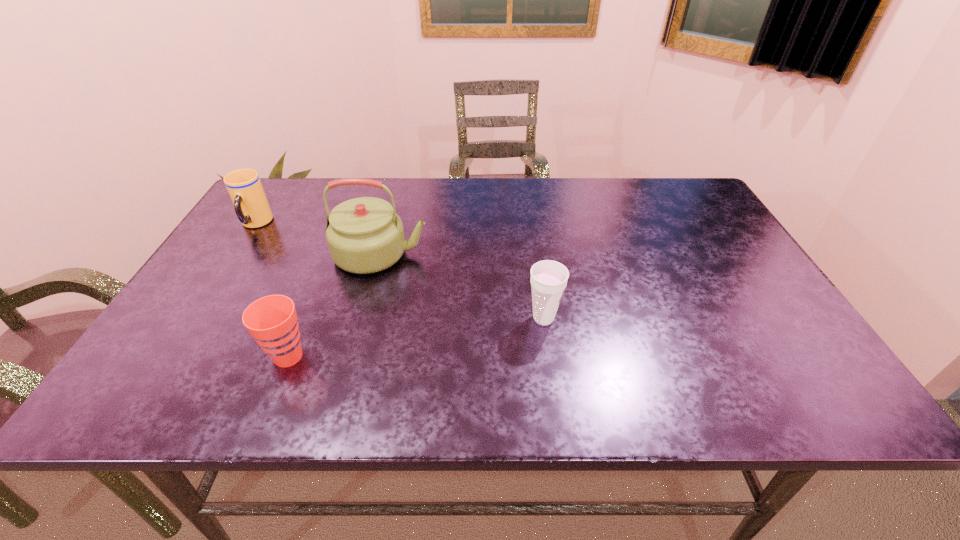
Identify which object is located as the third nearest to the nearest cup. Please provide its 2D coordinates. Your answer should be formatted as a tuple, i.e. [(x, y)], where the tuple contains the x and y coordinates of a point satisfying the conditions above.

[(548, 280)]

Choose which object is the third nearest neighbor to the tallest object. Please provide its 2D coordinates. Your answer should be formatted as a tuple, i.e. [(x, y)], where the tuple contains the x and y coordinates of a point satisfying the conditions above.

[(548, 280)]

Identify which cup is the closest to the tallest object. Please provide its 2D coordinates. Your answer should be formatted as a tuple, i.e. [(x, y)], where the tuple contains the x and y coordinates of a point satisfying the conditions above.

[(272, 320)]

The image size is (960, 540). I want to click on the second closest cup to the third farthest object, so click(244, 186).

What are the coordinates of `free space that satisfies the following two spatial constraints: 1. on the side of the rightmost object with the handle; 2. on the right side of the leftmost object` in the screenshot? It's located at (194, 318).

Find the location of a particular element. vacant area in the image that satisfies the following two spatial constraints: 1. on the side of the rightmost cup with the handle; 2. on the right side of the farthest cup is located at coordinates (194, 318).

Where is `vacant region that satisfies the following two spatial constraints: 1. on the side of the nearest object with the handle; 2. on the right side of the leftmost cup`? vacant region that satisfies the following two spatial constraints: 1. on the side of the nearest object with the handle; 2. on the right side of the leftmost cup is located at coordinates (169, 356).

Locate an element on the screen. free space that satisfies the following two spatial constraints: 1. at the spout of the kettle; 2. on the front side of the nearest cup is located at coordinates (354, 356).

Find the location of a particular element. vacant space that satisfies the following two spatial constraints: 1. on the side of the leftmost cup with the handle; 2. on the right side of the nearest cup is located at coordinates (169, 356).

Locate an element on the screen. This screenshot has width=960, height=540. vacant space that satisfies the following two spatial constraints: 1. on the side of the second nearest cup with the handle; 2. on the right side of the farthest cup is located at coordinates (194, 318).